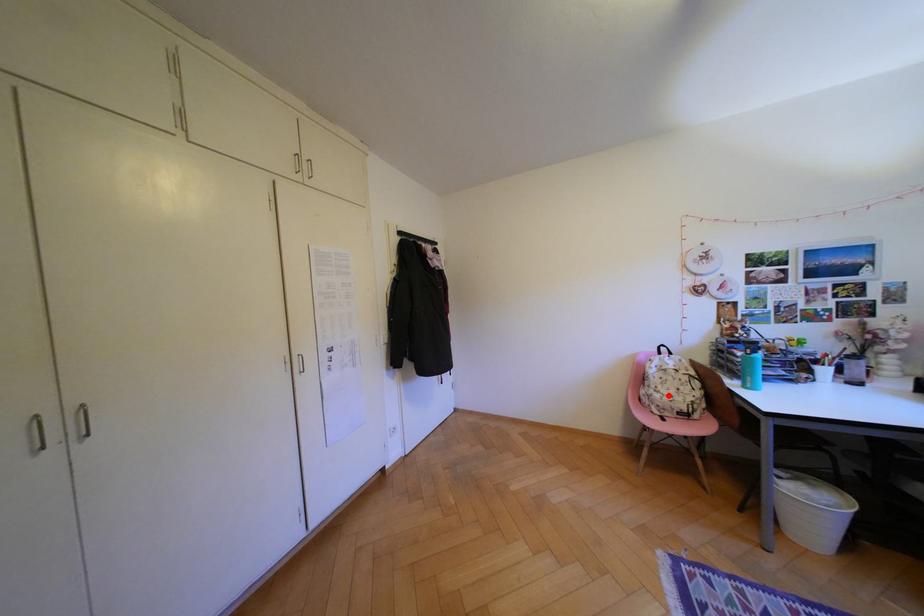
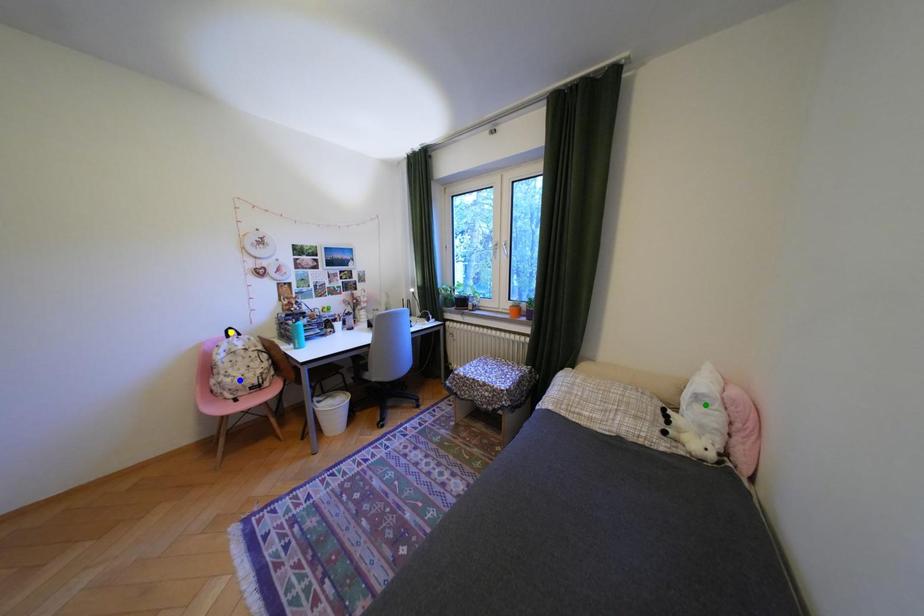
Question: I am providing you with two images of the same scene from different viewpoints. A red point is marked on the first image. You are given multiple points on the second image. Which point in image 2 is actually the same real-world point as the red point in image 1?

Choices:
 (A) green point
 (B) blue point
 (C) yellow point

Answer: (B)